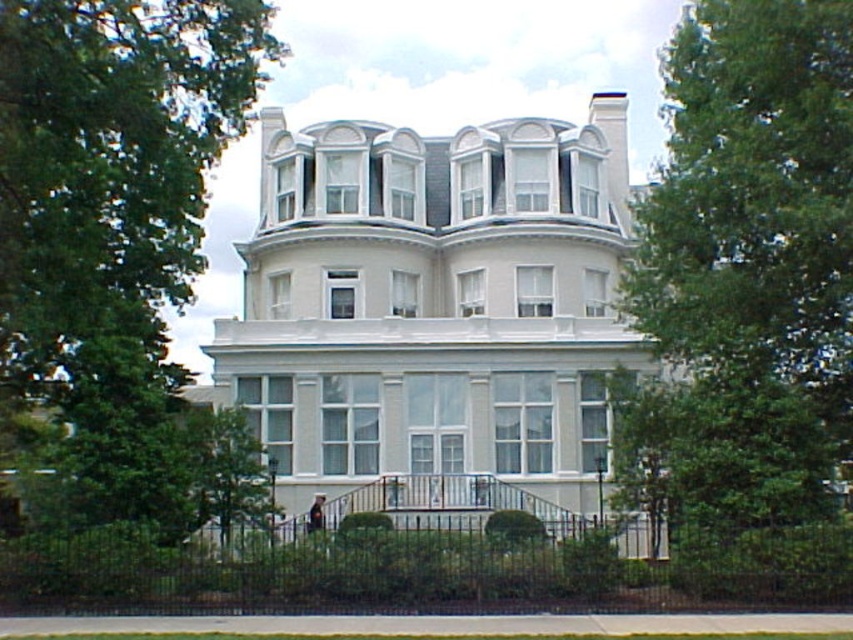
Question: Which of the following is the farthest from the observer?

Choices:
 (A) green leafy tree at upper left
 (B) green leafy tree at lower center
 (C) green leafy tree at center
 (D) white smooth mansion at center

Answer: (D)

Question: Can you confirm if white smooth mansion at center is positioned below green leafy tree at center?

Choices:
 (A) yes
 (B) no

Answer: (A)

Question: In this image, where is green leafy tree at center located relative to green leafy tree at upper left?

Choices:
 (A) below
 (B) above

Answer: (B)

Question: Among these objects, which one is nearest to the camera?

Choices:
 (A) green leafy tree at center
 (B) green leafy tree at upper left
 (C) green leafy tree at lower center

Answer: (B)

Question: Estimate the real-world distances between objects in this image. Which object is farther from the green leafy tree at center?

Choices:
 (A) green leafy tree at upper left
 (B) green leafy tree at lower center
 (C) white smooth mansion at center

Answer: (A)

Question: In this image, where is white smooth mansion at center located relative to green leafy tree at center?

Choices:
 (A) below
 (B) above

Answer: (A)